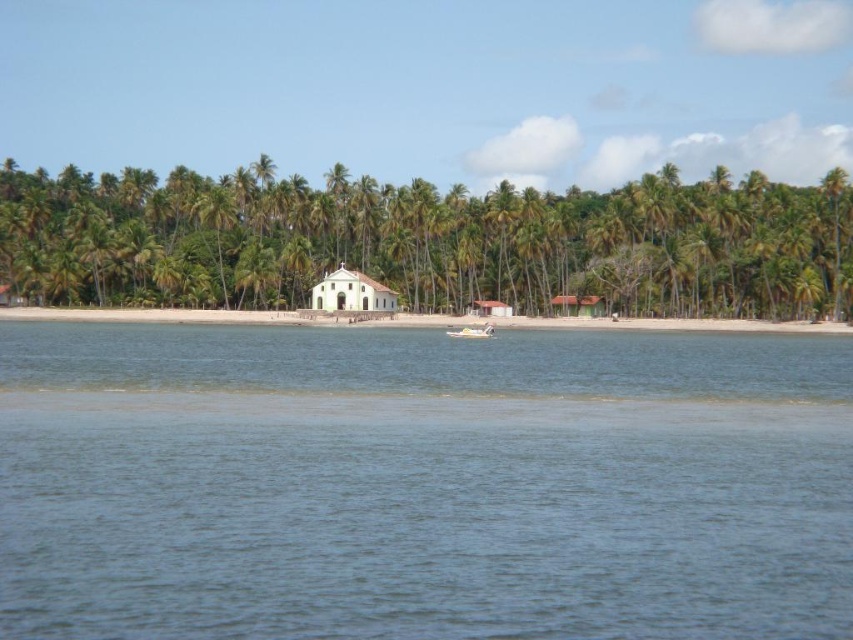
From the picture: Is green leafy palm tree at center thinner than white plastic boat at center?

No.

Does green leafy palm tree at center have a lesser height compared to white plastic boat at center?

No.

Measure the distance between point (576, 218) and camera.

Point (576, 218) is 110.95 meters away from camera.

Locate an element on the screen. Image resolution: width=853 pixels, height=640 pixels. green leafy palm tree at center is located at coordinates (427, 241).

Measure the distance from white wooden hut at center to brown wooden hut at center.

The distance of white wooden hut at center from brown wooden hut at center is 20.18 meters.

What are the coordinates of `white wooden hut at center` in the screenshot? It's located at (350, 292).

In the scene shown: Between white sand beach at center and white plastic boat at center, which one appears on the right side from the viewer's perspective?

From the viewer's perspective, white plastic boat at center appears more on the right side.

Who is more distant from viewer, (438, 317) or (476, 328)?

Point (438, 317)

Where is `white sand beach at center`? white sand beach at center is located at coordinates (409, 321).